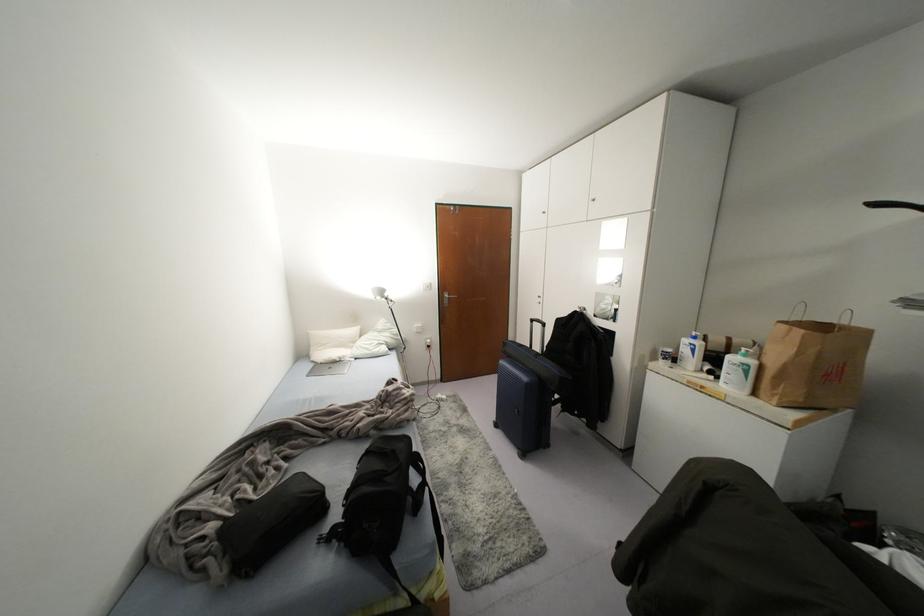
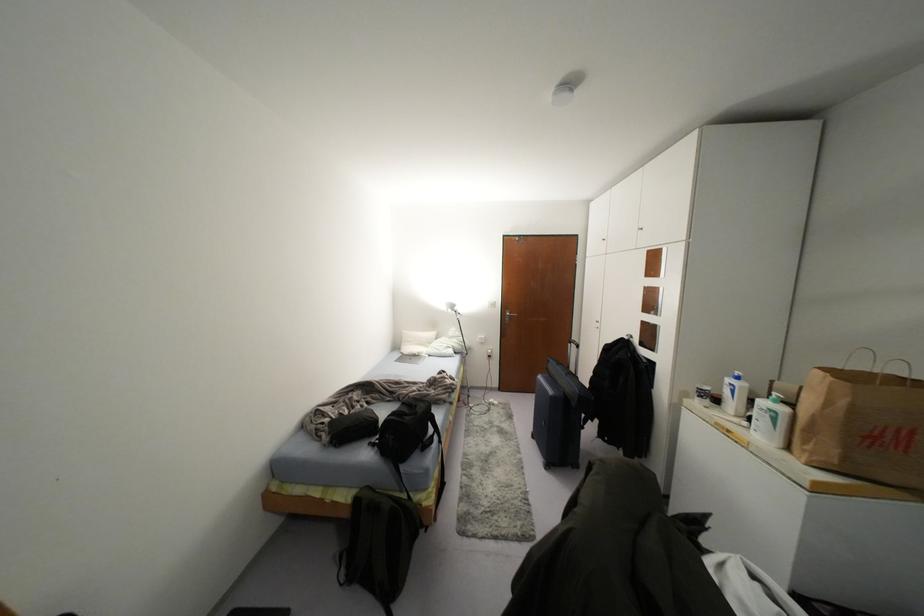
Which direction would the cameraman need to move to produce the second image?

The movement direction of the cameraman is right, backward.